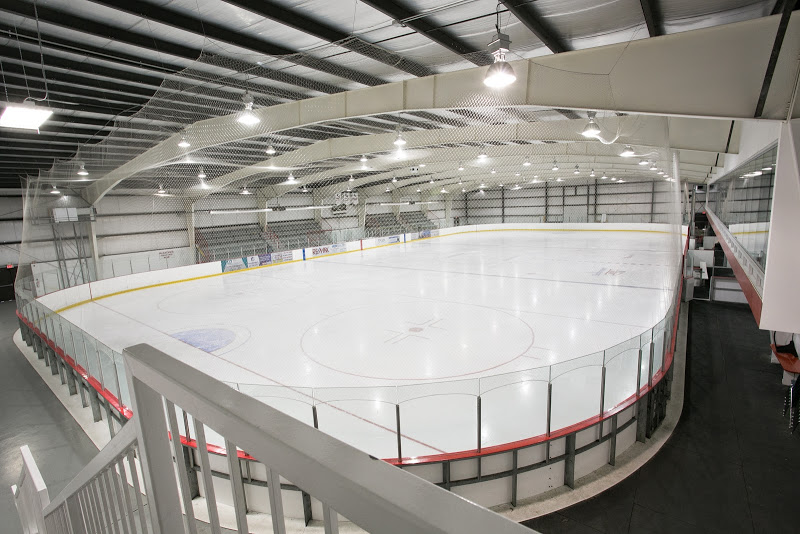
I want to click on walls, so click(x=140, y=222), click(x=534, y=206).